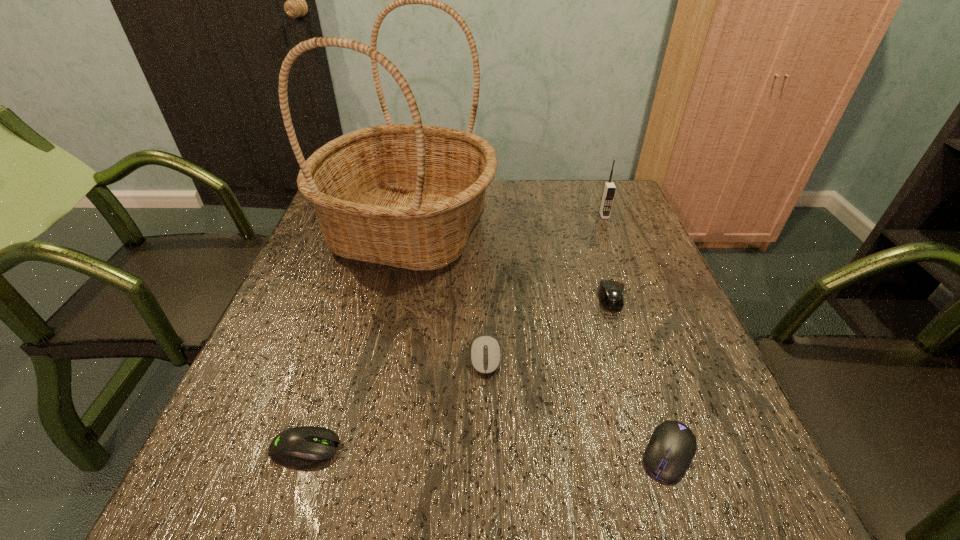
You are a GUI agent. You are given a task and a screenshot of the screen. Output one action in this format:
    pyautogui.click(x=<x>, y=<y>)
    Task: Click on the free space between the leftmost computer mouse and the basket
    The width and height of the screenshot is (960, 540).
    Given the screenshot: What is the action you would take?
    pyautogui.click(x=357, y=339)

Identify which object is the fourth nearest to the second tallest object. Please provide its 2D coordinates. Your answer should be formatted as a tuple, i.e. [(x, y)], where the tuple contains the x and y coordinates of a point satisfying the conditions above.

[(672, 446)]

Locate which object is the third closest to the leftmost computer mouse. Please provide its 2D coordinates. Your answer should be formatted as a tuple, i.e. [(x, y)], where the tuple contains the x and y coordinates of a point satisfying the conditions above.

[(672, 446)]

Locate an element on the screen. This screenshot has height=540, width=960. computer mouse object that ranks as the closest to the cellular telephone is located at coordinates (611, 292).

Identify which computer mouse is the second nearest to the third nearest object. Please provide its 2D coordinates. Your answer should be formatted as a tuple, i.e. [(x, y)], where the tuple contains the x and y coordinates of a point satisfying the conditions above.

[(611, 292)]

Locate an element on the screen. This screenshot has height=540, width=960. blank space that satisfies the following two spatial constraints: 1. on the wheel side of the third nearest computer mouse; 2. on the wheel side of the leftmost computer mouse is located at coordinates (487, 448).

Locate an element on the screen. The image size is (960, 540). free space that satisfies the following two spatial constraints: 1. on the front-facing side of the cellular telephone; 2. on the wheel side of the leftmost computer mouse is located at coordinates (694, 448).